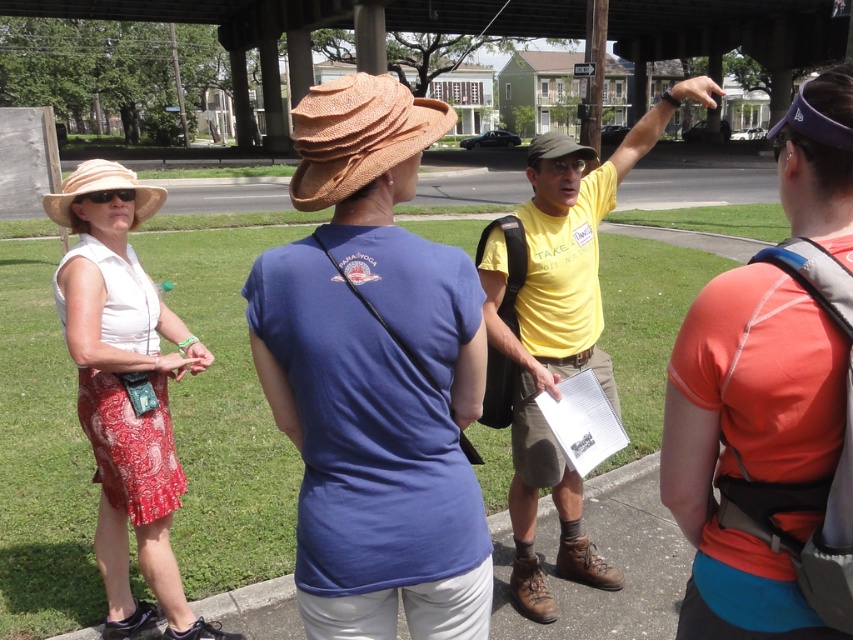
Does orange fabric backpack at right come behind beige straw hat at left?

No.

Who is higher up, orange fabric backpack at right or beige straw hat at left?

beige straw hat at left is above.

I want to click on orange fabric backpack at right, so click(x=751, y=448).

This screenshot has height=640, width=853. Find the location of `orange fabric backpack at right`. orange fabric backpack at right is located at coordinates (751, 448).

Can you confirm if matte red dress at left is positioned above straw textured hat at center?

No, matte red dress at left is not above straw textured hat at center.

Between matte red dress at left and straw textured hat at center, which one is positioned lower?

Positioned lower is matte red dress at left.

Locate an element on the screen. matte red dress at left is located at coordinates (125, 392).

Where is `matte red dress at left`? The width and height of the screenshot is (853, 640). matte red dress at left is located at coordinates (125, 392).

Is matte straw hat at center bigger than yellow cotton shirt at center?

No, matte straw hat at center is not bigger than yellow cotton shirt at center.

Which is behind, point (434, 600) or point (558, 300)?

Positioned behind is point (558, 300).

You are a GUI agent. You are given a task and a screenshot of the screen. Output one action in this format:
    pyautogui.click(x=<x>, y=<y>)
    Task: Click on the matte straw hat at center
    The height and width of the screenshot is (640, 853).
    Given the screenshot: What is the action you would take?
    pyautogui.click(x=374, y=376)